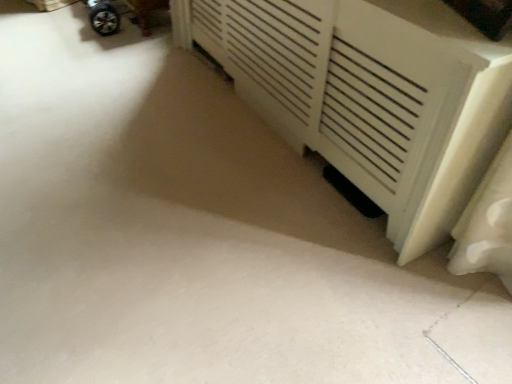
What do you see at coordinates (103, 17) in the screenshot? This screenshot has height=384, width=512. I see `metallic silver wheel at upper left` at bounding box center [103, 17].

This screenshot has height=384, width=512. In order to click on metallic silver wheel at upper left in this screenshot , I will do `click(103, 17)`.

What is the approximate height of metallic silver wheel at upper left?

metallic silver wheel at upper left is 9.46 inches tall.

This screenshot has height=384, width=512. Describe the element at coordinates (370, 95) in the screenshot. I see `white matte radiator at center` at that location.

The width and height of the screenshot is (512, 384). I want to click on white matte radiator at center, so click(x=370, y=95).

This screenshot has height=384, width=512. In order to click on metallic silver wheel at upper left in this screenshot , I will do `click(103, 17)`.

Between metallic silver wheel at upper left and white matte radiator at center, which one appears on the left side from the viewer's perspective?

Positioned to the left is metallic silver wheel at upper left.

Between metallic silver wheel at upper left and white matte radiator at center, which one is positioned behind?

metallic silver wheel at upper left is further away from the camera.

Does point (91, 1) come closer to viewer compared to point (479, 49)?

That is False.

From the image's perspective, which object appears higher, metallic silver wheel at upper left or white matte radiator at center?

metallic silver wheel at upper left is shown above in the image.

From a real-world perspective, is metallic silver wheel at upper left physically above white matte radiator at center?

No, from a real-world perspective, metallic silver wheel at upper left is not over white matte radiator at center

Considering the relative sizes of metallic silver wheel at upper left and white matte radiator at center in the image provided, is metallic silver wheel at upper left wider than white matte radiator at center?

In fact, metallic silver wheel at upper left might be narrower than white matte radiator at center.

Looking at this image, considering the sizes of objects metallic silver wheel at upper left and white matte radiator at center in the image provided, who is shorter, metallic silver wheel at upper left or white matte radiator at center?

metallic silver wheel at upper left is shorter.

Considering the sizes of objects metallic silver wheel at upper left and white matte radiator at center in the image provided, who is smaller, metallic silver wheel at upper left or white matte radiator at center?

metallic silver wheel at upper left is smaller.

Is metallic silver wheel at upper left spatially inside white matte radiator at center, or outside of it?

The correct answer is: outside.

Are metallic silver wheel at upper left and white matte radiator at center making contact?

They are not placed beside each other.

Is white matte radiator at center at the back of metallic silver wheel at upper left?

No.

How many degrees apart are the facing directions of metallic silver wheel at upper left and white matte radiator at center?

The angle between the facing direction of metallic silver wheel at upper left and the facing direction of white matte radiator at center is 5.16 degrees.

Where is `furniture that appears on the right of metallic silver wheel at upper left`? The image size is (512, 384). furniture that appears on the right of metallic silver wheel at upper left is located at coordinates (370, 95).

Between white matte radiator at center and metallic silver wheel at upper left, which one appears on the left side from the viewer's perspective?

metallic silver wheel at upper left is more to the left.

Considering the positions of objects white matte radiator at center and metallic silver wheel at upper left in the image provided, who is behind, white matte radiator at center or metallic silver wheel at upper left?

metallic silver wheel at upper left.

Is point (356, 2) closer to camera compared to point (91, 22)?

Yes.

From the image's perspective, which one is positioned lower, white matte radiator at center or metallic silver wheel at upper left?

white matte radiator at center, from the image's perspective.

In the scene shown: From a real-world perspective, is white matte radiator at center beneath metallic silver wheel at upper left?

Incorrect, from a real-world perspective, white matte radiator at center is higher than metallic silver wheel at upper left.

In the scene shown: Does white matte radiator at center have a greater width compared to metallic silver wheel at upper left?

Yes.

Looking at this image, is white matte radiator at center shorter than metallic silver wheel at upper left?

In fact, white matte radiator at center may be taller than metallic silver wheel at upper left.

Considering the relative sizes of white matte radiator at center and metallic silver wheel at upper left in the image provided, is white matte radiator at center smaller than metallic silver wheel at upper left?

Incorrect, white matte radiator at center is not smaller in size than metallic silver wheel at upper left.

Which is correct: white matte radiator at center is inside metallic silver wheel at upper left, or outside of it?

white matte radiator at center exists outside the volume of metallic silver wheel at upper left.

Are white matte radiator at center and metallic silver wheel at upper left located far from each other?

Indeed, white matte radiator at center is not near metallic silver wheel at upper left.

Is white matte radiator at center positioned with its back to metallic silver wheel at upper left?

white matte radiator at center is not turned away from metallic silver wheel at upper left.

Can you tell me how much white matte radiator at center and metallic silver wheel at upper left differ in facing direction?

5.16 degrees separate the facing orientations of white matte radiator at center and metallic silver wheel at upper left.

Locate an element on the screen. furniture in front of the metallic silver wheel at upper left is located at coordinates (370, 95).

You are a GUI agent. You are given a task and a screenshot of the screen. Output one action in this format:
    pyautogui.click(x=<x>, y=<y>)
    Task: Click on the wheel below the white matte radiator at center (from a real-world perspective)
    Image resolution: width=512 pixels, height=384 pixels.
    Given the screenshot: What is the action you would take?
    pyautogui.click(x=103, y=17)

Where is `furniture below the metallic silver wheel at upper left (from the image's perspective)`? furniture below the metallic silver wheel at upper left (from the image's perspective) is located at coordinates (370, 95).